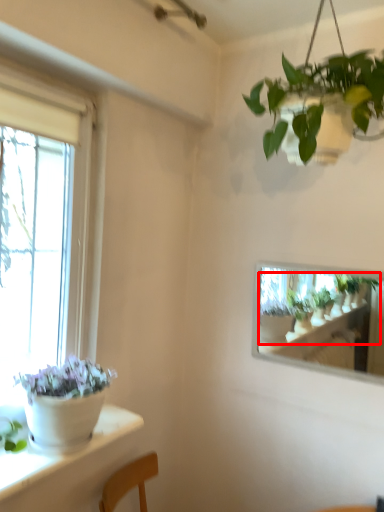
Question: From the image's perspective, considering the relative positions of houseplant (annotated by the red box) and houseplant in the image provided, where is houseplant (annotated by the red box) located with respect to the staircase?

Choices:
 (A) below
 (B) above

Answer: (A)